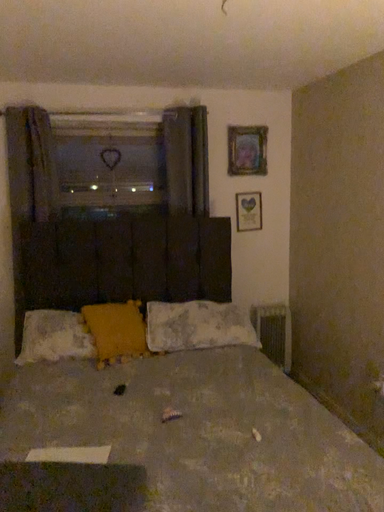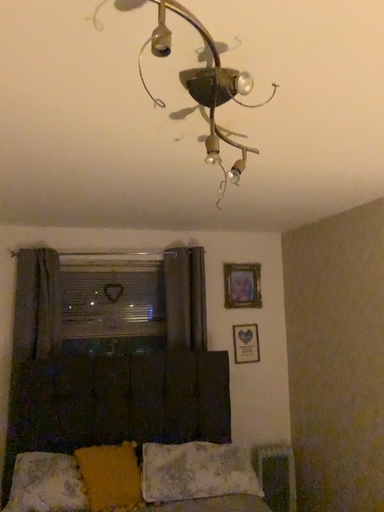
Question: Which way did the camera rotate in the video?

Choices:
 (A) rotated downward
 (B) rotated upward

Answer: (B)